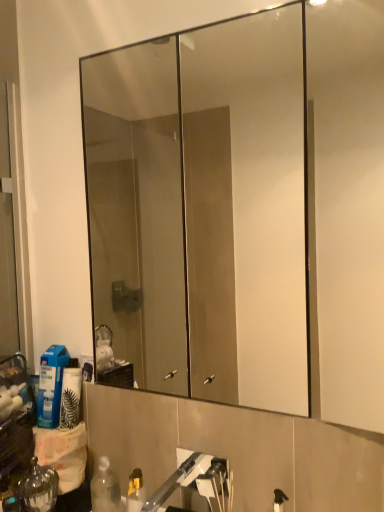
Question: Should I look upward or downward to see brushed metal faucet at lower center?

Choices:
 (A) down
 (B) up

Answer: (A)

Question: From the image's perspective, is brushed metal faucet at lower center under clear glass mirror at upper center?

Choices:
 (A) no
 (B) yes

Answer: (B)

Question: Considering the relative sizes of brushed metal faucet at lower center and clear glass mirror at upper center in the image provided, is brushed metal faucet at lower center taller than clear glass mirror at upper center?

Choices:
 (A) yes
 (B) no

Answer: (B)

Question: Is brushed metal faucet at lower center not within clear glass mirror at upper center?

Choices:
 (A) yes
 (B) no

Answer: (A)

Question: From a real-world perspective, is brushed metal faucet at lower center physically below clear glass mirror at upper center?

Choices:
 (A) no
 (B) yes

Answer: (B)

Question: Is brushed metal faucet at lower center directly adjacent to clear glass mirror at upper center?

Choices:
 (A) yes
 (B) no

Answer: (B)

Question: From the image's perspective, would you say brushed metal faucet at lower center is positioned over clear glass mirror at upper center?

Choices:
 (A) yes
 (B) no

Answer: (B)

Question: Is the position of shiny metallic bottle at lower left more distant than that of blue plastic bottle at lower left?

Choices:
 (A) yes
 (B) no

Answer: (B)

Question: Can you confirm if shiny metallic bottle at lower left is taller than blue plastic bottle at lower left?

Choices:
 (A) yes
 (B) no

Answer: (B)

Question: Is shiny metallic bottle at lower left not near blue plastic bottle at lower left?

Choices:
 (A) no
 (B) yes

Answer: (A)

Question: Considering the relative sizes of shiny metallic bottle at lower left and blue plastic bottle at lower left in the image provided, is shiny metallic bottle at lower left shorter than blue plastic bottle at lower left?

Choices:
 (A) no
 (B) yes

Answer: (B)

Question: Does shiny metallic bottle at lower left turn towards blue plastic bottle at lower left?

Choices:
 (A) no
 (B) yes

Answer: (A)

Question: Is shiny metallic bottle at lower left facing away from blue plastic bottle at lower left?

Choices:
 (A) no
 (B) yes

Answer: (A)

Question: Is blue plastic bottle at lower left at the left side of brushed metal faucet at lower center?

Choices:
 (A) yes
 (B) no

Answer: (A)